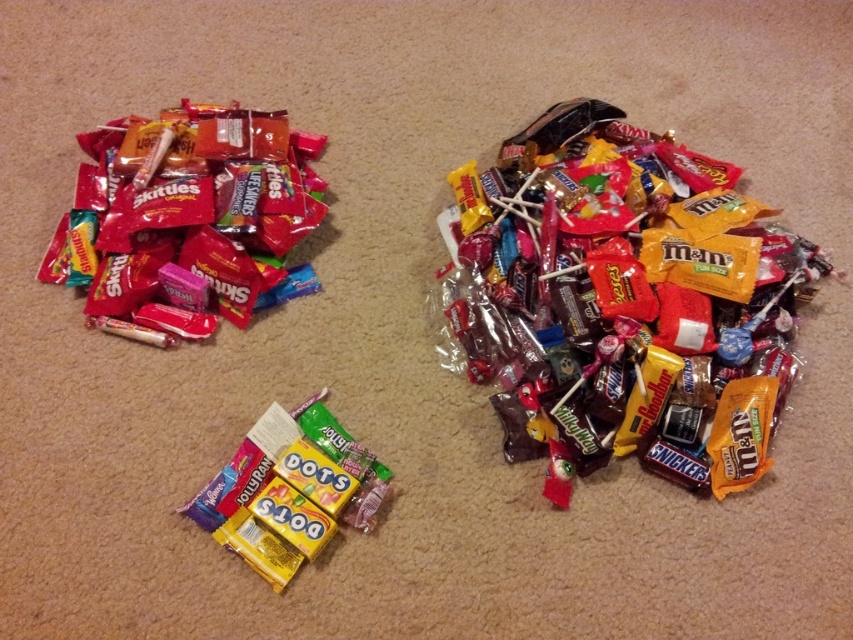
Does shiny plastic skittles at upper left have a lesser height compared to yellow matte dots at center?

In fact, shiny plastic skittles at upper left may be taller than yellow matte dots at center.

Who is more forward, (x=175, y=164) or (x=337, y=472)?

Positioned in front is point (x=337, y=472).

Measure the distance between shiny plastic skittles at upper left and camera.

shiny plastic skittles at upper left is 4.85 feet from camera.

Find the location of a particular element. shiny plastic skittles at upper left is located at coordinates (189, 216).

Does point (715, 179) come closer to viewer compared to point (254, 435)?

No, it is not.

Who is taller, shiny chocolate bar at center or yellow matte dots at center?

With more height is shiny chocolate bar at center.

Measure the distance between shiny chocolate bar at center and camera.

4.41 feet

You are a GUI agent. You are given a task and a screenshot of the screen. Output one action in this format:
    pyautogui.click(x=<x>, y=<y>)
    Task: Click on the shiny chocolate bar at center
    This screenshot has height=640, width=853.
    Given the screenshot: What is the action you would take?
    pyautogui.click(x=612, y=276)

Can you confirm if shiny chocolate bar at center is positioned to the left of shiny plastic skittles at upper left?

No, shiny chocolate bar at center is not to the left of shiny plastic skittles at upper left.

Which of these two, shiny chocolate bar at center or shiny plastic skittles at upper left, stands shorter?

Standing shorter between the two is shiny plastic skittles at upper left.

Does point (604, 173) lie in front of point (251, 113)?

Yes, it is in front of point (251, 113).

In order to click on shiny chocolate bar at center in this screenshot , I will do `click(612, 276)`.